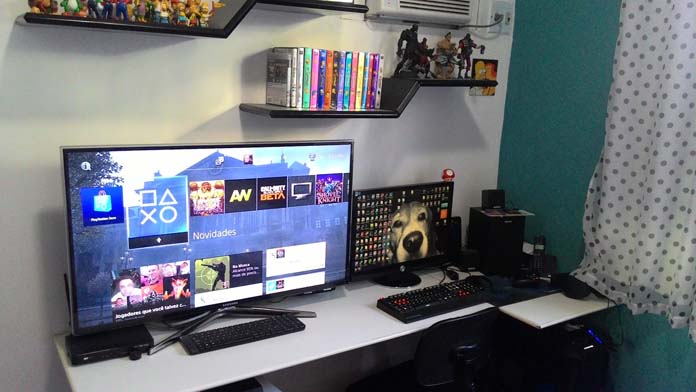
Find the location of a particular element. This screenshot has width=696, height=392. wifi router is located at coordinates (92, 343).